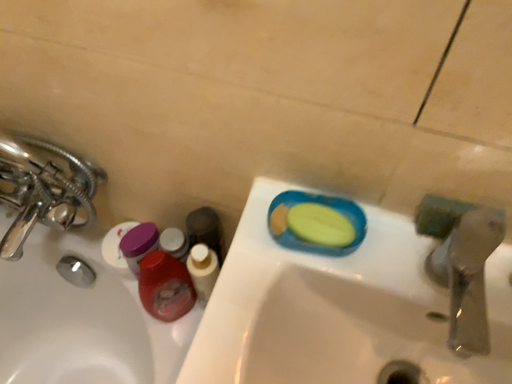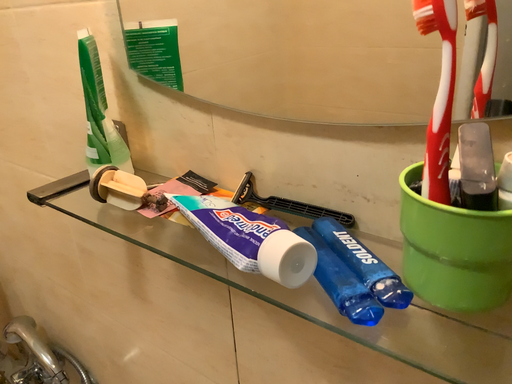
Question: How did the camera likely rotate when shooting the video?

Choices:
 (A) rotated left
 (B) rotated right

Answer: (A)